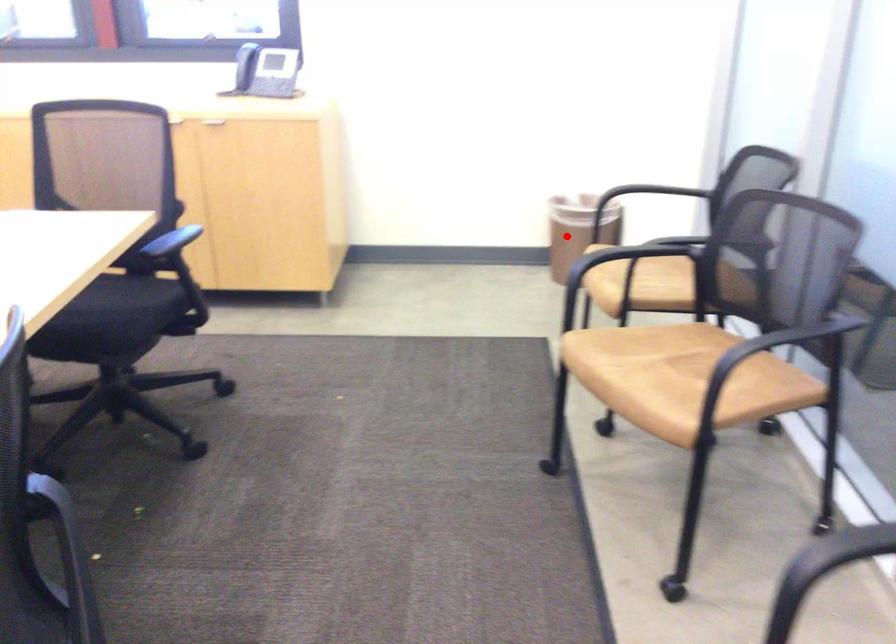
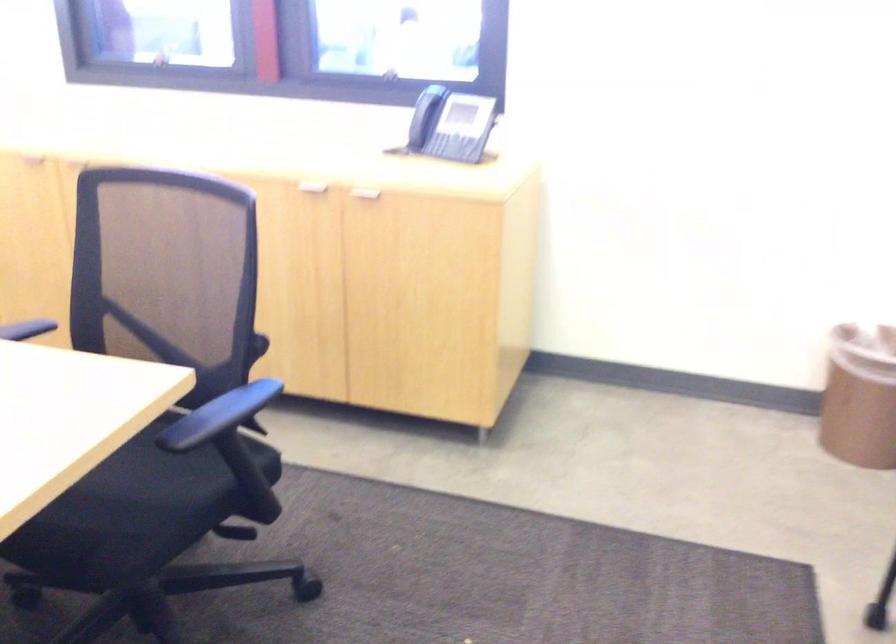
Where in the second image is the point corresponding to the highlighted location from the first image?

(859, 395)